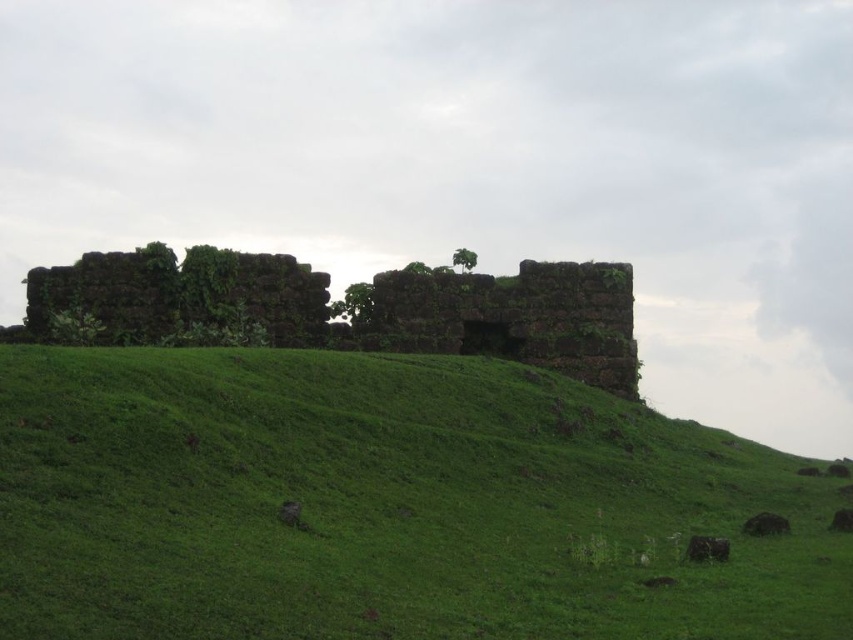
Question: Considering the relative positions of green grassy hillside at center and rusty stone castle at center in the image provided, where is green grassy hillside at center located with respect to rusty stone castle at center?

Choices:
 (A) left
 (B) right

Answer: (B)

Question: Among these points, which one is nearest to the camera?

Choices:
 (A) (263, 308)
 (B) (70, 513)

Answer: (B)

Question: Which point appears closest to the camera in this image?

Choices:
 (A) (291, 312)
 (B) (230, 509)

Answer: (B)

Question: Does green grassy hillside at center appear on the left side of rusty stone castle at center?

Choices:
 (A) yes
 (B) no

Answer: (B)

Question: Is green grassy hillside at center closer to the viewer compared to rusty stone castle at center?

Choices:
 (A) yes
 (B) no

Answer: (A)

Question: Which point is farther from the camera taking this photo?

Choices:
 (A) (424, 449)
 (B) (436, 291)

Answer: (B)